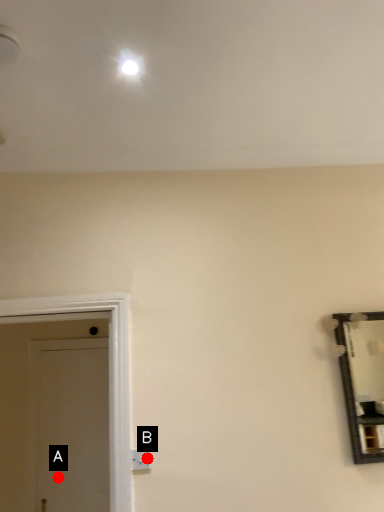
Question: Two points are circled on the image, labeled by A and B beside each circle. Which point is closer to the camera?

Choices:
 (A) A is closer
 (B) B is closer

Answer: (B)